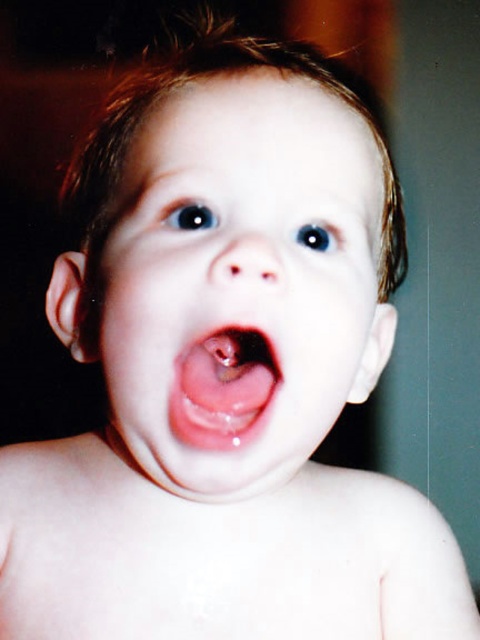
Consider the image. You are a photographer adjusting the lighting for a portrait session. You notice the smooth skin face at center and the pink glossy tongue at center in the frame. Which object should you focus on to ensure proper exposure since it is closer to the camera?

The smooth skin face at center should be focused on because it is positioned on the right side of the pink glossy tongue at center, indicating it is closer to the camera.

You are a photographer adjusting your camera settings to capture a close up of a child. The subject has a smooth skin face at center. To ensure the face is in focus, what distance should your camera be set to?

The smooth skin face at center is 10.55 inches from camera, so the camera should be set to a focus distance of 10.55 inches to ensure the face is in focus.

Based on the scene description, which object is wider, the smooth skin face at center or the pink glossy tongue at center?

The smooth skin face at center is wider than the pink glossy tongue at center according to the description.